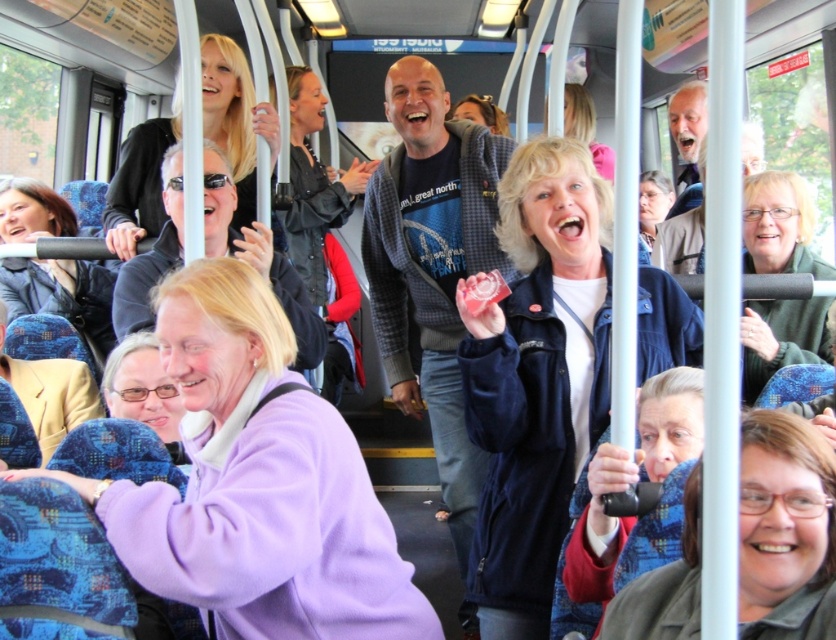
Question: Which is nearer to the matte blue cardigan at center?

Choices:
 (A) purple fleece jacket at lower left
 (B) matte black camera at lower right

Answer: (A)

Question: Which point is closer to the camera taking this photo?

Choices:
 (A) pos(636,624)
 (B) pos(266,273)
 (C) pos(418,275)

Answer: (A)

Question: Is matte blue cardigan at center below purple fleece jacket at lower left?

Choices:
 (A) yes
 (B) no

Answer: (A)

Question: Which object is positioned closest to the purple fleece jacket at lower left?

Choices:
 (A) matte blue cardigan at center
 (B) matte black camera at lower right

Answer: (A)

Question: Does matte black camera at lower right have a larger size compared to purple fleece jacket at lower left?

Choices:
 (A) no
 (B) yes

Answer: (A)

Question: Can you confirm if matte blue cardigan at center is wider than matte black camera at lower right?

Choices:
 (A) yes
 (B) no

Answer: (A)